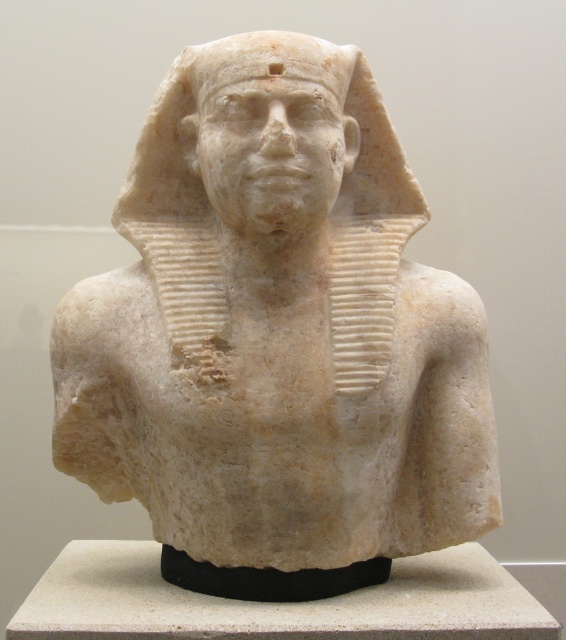
Which is more to the left, white marble bust at center or white marble head at center?

Positioned to the left is white marble head at center.

Between white marble bust at center and white marble head at center, which one is positioned lower?

Positioned lower is white marble bust at center.

Between point (367, 292) and point (191, 93), which one is positioned behind?

Positioned behind is point (191, 93).

The width and height of the screenshot is (566, 640). In order to click on white marble bust at center in this screenshot , I will do `click(276, 337)`.